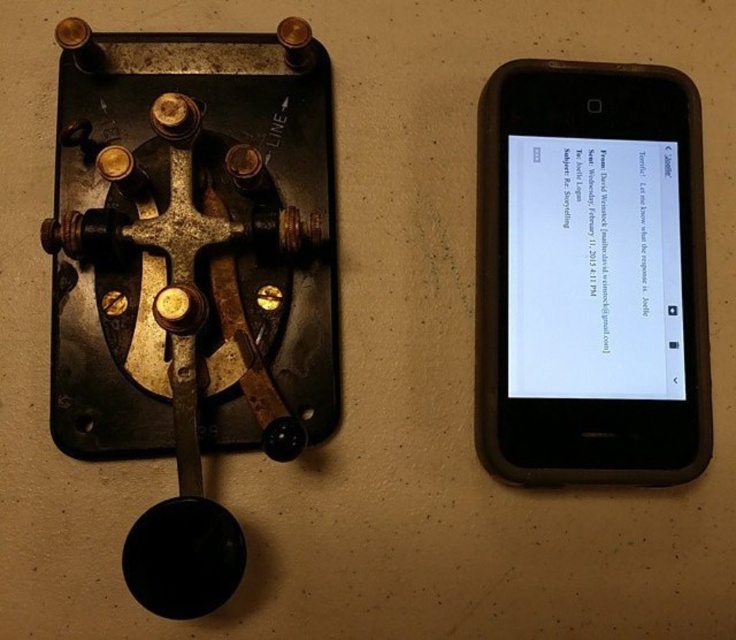
You are standing in front of the image and want to determine the spatial relationship between the two points. Which point is closer to you, point (54, 157) or point (679, 452)?

Point (679, 452) is closer to you because the description states that point (54, 157) is behind point (679, 452).